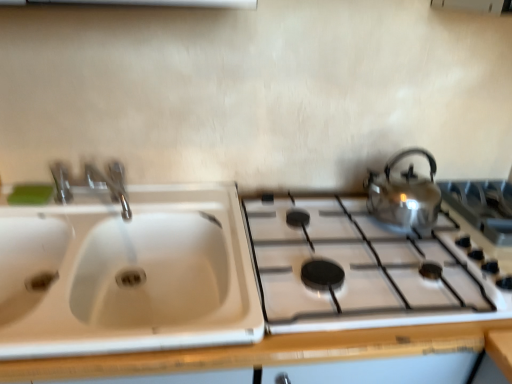
Question: Is green matte soap at upper left facing towards satin silver gas stove at right, the 2th gas stove from the left?

Choices:
 (A) no
 (B) yes

Answer: (A)

Question: Is green matte soap at upper left behind satin silver gas stove at right, which is the first gas stove from right to left?

Choices:
 (A) yes
 (B) no

Answer: (A)

Question: Can you confirm if green matte soap at upper left is shorter than satin silver gas stove at right, the 2th gas stove from the left?

Choices:
 (A) no
 (B) yes

Answer: (B)

Question: Considering the relative sizes of green matte soap at upper left and satin silver gas stove at right, which is the first gas stove from right to left, in the image provided, is green matte soap at upper left bigger than satin silver gas stove at right, which is the first gas stove from right to left,?

Choices:
 (A) yes
 (B) no

Answer: (B)

Question: From a real-world perspective, is green matte soap at upper left over satin silver gas stove at right, the 2th gas stove from the left?

Choices:
 (A) yes
 (B) no

Answer: (A)

Question: Is green matte soap at upper left not close to satin silver gas stove at right, the 2th gas stove from the left?

Choices:
 (A) no
 (B) yes

Answer: (B)

Question: Is the position of white plastic sink at left less distant than that of shiny metallic kettle at right?

Choices:
 (A) no
 (B) yes

Answer: (B)

Question: Considering the relative sizes of white plastic sink at left and shiny metallic kettle at right in the image provided, is white plastic sink at left taller than shiny metallic kettle at right?

Choices:
 (A) yes
 (B) no

Answer: (A)

Question: Is white plastic sink at left not close to shiny metallic kettle at right?

Choices:
 (A) yes
 (B) no

Answer: (B)

Question: Is white plastic sink at left positioned with its back to shiny metallic kettle at right?

Choices:
 (A) no
 (B) yes

Answer: (A)

Question: Can you confirm if white plastic sink at left is thinner than shiny metallic kettle at right?

Choices:
 (A) yes
 (B) no

Answer: (B)

Question: From a real-world perspective, is white plastic sink at left beneath shiny metallic kettle at right?

Choices:
 (A) yes
 (B) no

Answer: (A)

Question: Is shiny metallic kettle at right oriented away from shiny metallic gas stove at right, the 1th gas stove viewed from the left?

Choices:
 (A) yes
 (B) no

Answer: (B)